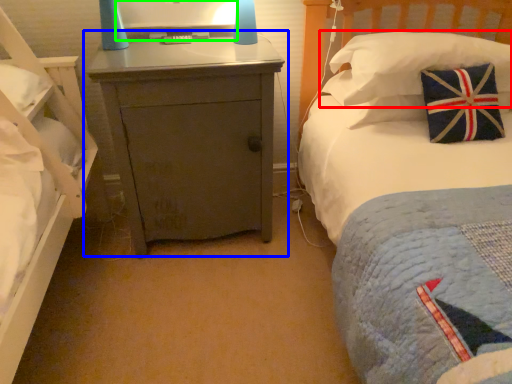
Question: Estimate the real-world distances between objects in this image. Which object is closer to pillow (highlighted by a red box), nightstand (highlighted by a blue box) or computer monitor (highlighted by a green box)?

Choices:
 (A) nightstand
 (B) computer monitor

Answer: (A)